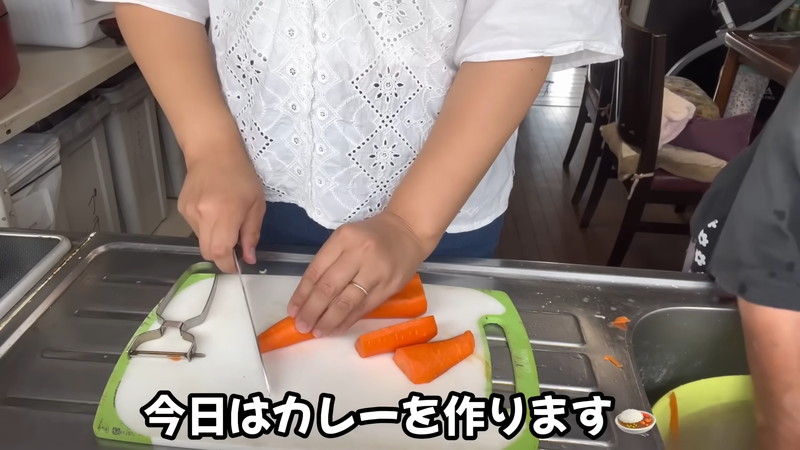
Identify the location of waste bin. This screenshot has width=800, height=450. (90, 190), (126, 152), (32, 190), (170, 147).